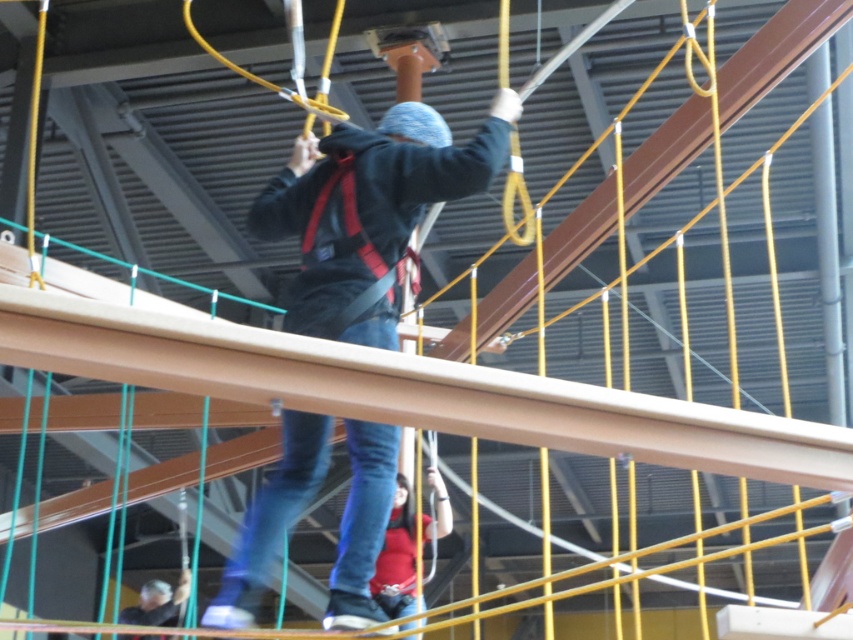
Looking at this image, you are a safety inspector checking the climbing setup. You notice two clothing items worn by the climber. The dark blue fleece jacket at center and the matte red shirt at lower center. Which clothing item is positioned to the right of the other?

The dark blue fleece jacket at center is positioned on the right side of matte red shirt at lower center.

You are a warehouse worker who needs to place a 3.5 meter long ladder between the matte red shirt at lower center and the dark gray fabric cap at lower left. Can the ladder fit between them?

The distance between the matte red shirt at lower center and the dark gray fabric cap at lower left is 3.58 meters, so the 3.5 meter ladder can fit between them since it is slightly shorter than the available space.

You are a safety inspector checking the climbing setup. You notice two items in the scene that might pose a safety hazard if misplaced. The items are the matte red shirt at lower center and the dark gray fabric cap at lower left. Based on their sizes, which item is more likely to be overlooked by the climber during the activity?

The matte red shirt at lower center is smaller than the dark gray fabric cap at lower left, so it is more likely to be overlooked by the climber during the activity.